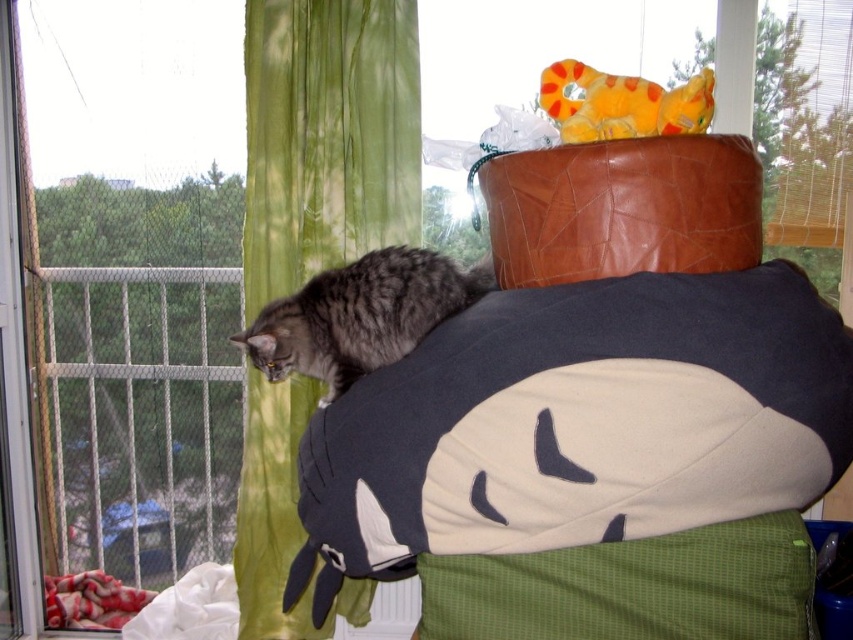
Does metal mesh window at left have a greater height compared to soft plush toy at upper right?

Yes, metal mesh window at left is taller than soft plush toy at upper right.

Who is more distant from viewer, (140, 449) or (650, 108)?

Positioned behind is point (140, 449).

Where is `metal mesh window at left`? This screenshot has width=853, height=640. metal mesh window at left is located at coordinates (125, 348).

Is metal mesh window at left below green sheer curtain at upper left?

No, metal mesh window at left is not below green sheer curtain at upper left.

Who is higher up, metal mesh window at left or green sheer curtain at upper left?

Result: metal mesh window at left is above.

Where is `metal mesh window at left`? The width and height of the screenshot is (853, 640). metal mesh window at left is located at coordinates pyautogui.click(x=125, y=348).

Identify the location of metal mesh window at left. This screenshot has height=640, width=853. (125, 348).

Which is below, gray fur cat at upper left or soft plush toy at upper right?

Positioned lower is gray fur cat at upper left.

Does gray fur cat at upper left have a lesser width compared to soft plush toy at upper right?

No, gray fur cat at upper left is not thinner than soft plush toy at upper right.

Image resolution: width=853 pixels, height=640 pixels. Find the location of `gray fur cat at upper left`. gray fur cat at upper left is located at coordinates (360, 316).